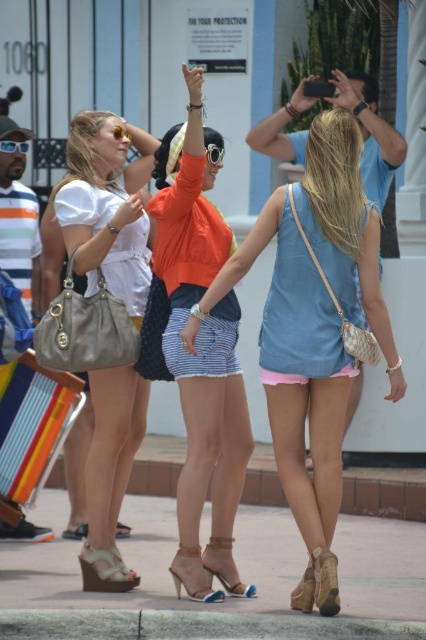
Which is in front, point (302, 628) or point (78, 536)?

Point (302, 628)

At what (x,y) coordinates should I click in order to perform the action: click on smooth concrete pavement at lower center. Please return your answer as a coordinate pair (x, y). The height and width of the screenshot is (640, 426). Looking at the image, I should click on (227, 596).

Where is `smooth concrete pavement at lower center`? smooth concrete pavement at lower center is located at coordinates (227, 596).

Where is `smooth concrete pavement at lower center`? This screenshot has width=426, height=640. smooth concrete pavement at lower center is located at coordinates (227, 596).

Does matte beige sandal at lower center appear under matte black sunglasses at upper left?

Indeed, matte beige sandal at lower center is positioned under matte black sunglasses at upper left.

Is matte beige sandal at lower center shorter than matte black sunglasses at upper left?

Correct, matte beige sandal at lower center is not as tall as matte black sunglasses at upper left.

Find the location of a particular element. This screenshot has height=640, width=426. matte beige sandal at lower center is located at coordinates (75, 531).

Is beige suede sandal at lower center above matte black sunglasses at upper left?

No.

Is point (104, 589) positioned behind point (2, 148)?

That is False.

Between point (81, 560) and point (2, 145), which one is positioned in front?

Point (81, 560) is more forward.

The image size is (426, 640). Find the location of `beige suede sandal at lower center`. beige suede sandal at lower center is located at coordinates (104, 570).